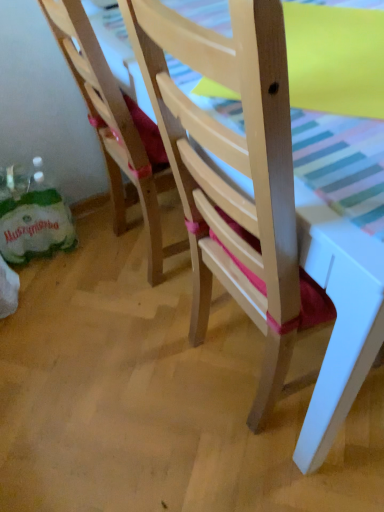
This screenshot has width=384, height=512. Identify the location of blank space situated above matte yellow table at upper right (from a real-world perspective). (327, 48).